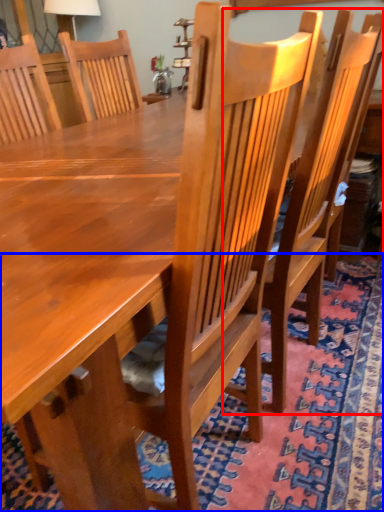
Question: Which object is further to the camera taking this photo, chair (highlighted by a red box) or mat (highlighted by a blue box)?

Choices:
 (A) chair
 (B) mat

Answer: (A)